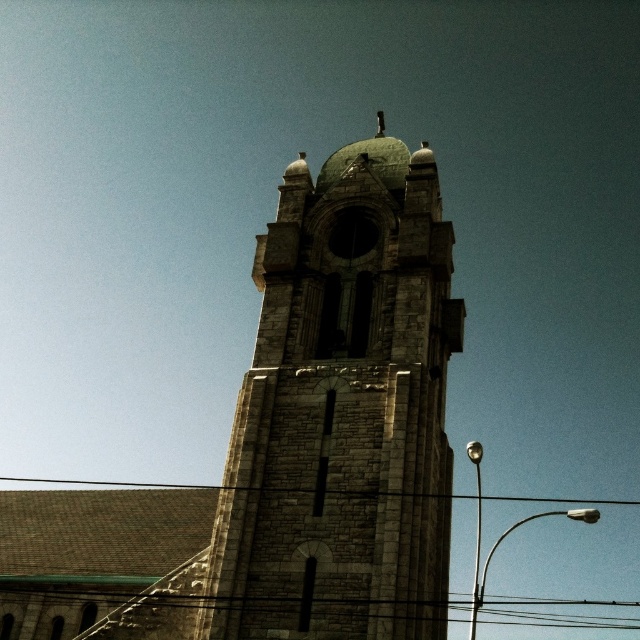
Looking at this image, you are standing at the base of the stone tower at center and looking upwards. There is a black wire at lower center in your line of sight. Which object will appear higher in your view?

The stone tower at center appears higher in your view because it is located above the black wire at lower center.

Consider the image. You are standing near a stone tower at center and want to take a photo of it. If you need to be at least 35 meters away to capture the entire structure in one frame, can you do it from your current position?

The stone tower at center is 36.64 meters away from viewer, so yes, you can capture the entire structure in one frame since you are already beyond the required 35 meters distance.

You are standing in front of the stone tower at center and the black wire at lower center. Based on their widths, which object would appear narrower from your perspective?

The stone tower at center has a lesser width compared to the black wire at lower center, so it would appear narrower from your perspective.